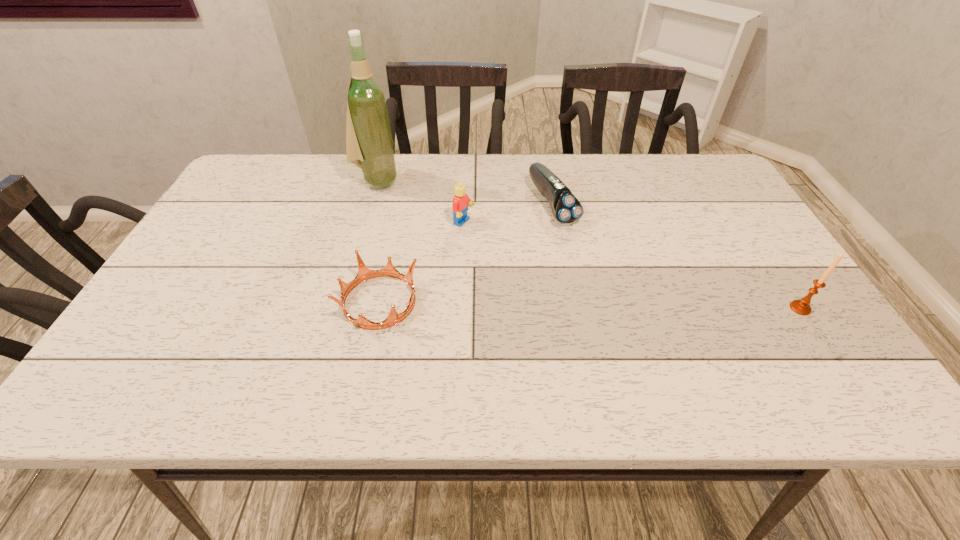
In order to click on crown in this screenshot , I will do `click(364, 273)`.

I want to click on the rightmost object, so click(x=801, y=307).

Locate an element on the screen. The width and height of the screenshot is (960, 540). the second tallest object is located at coordinates (801, 307).

Image resolution: width=960 pixels, height=540 pixels. I want to click on the third shortest object, so click(461, 201).

Identify the location of Lego. (461, 201).

You are a GUI agent. You are given a task and a screenshot of the screen. Output one action in this format:
    pyautogui.click(x=<x>, y=<y>)
    Task: Click on the tallest object
    
    Given the screenshot: What is the action you would take?
    pyautogui.click(x=369, y=145)

Where is `electric shaver`? Image resolution: width=960 pixels, height=540 pixels. electric shaver is located at coordinates (566, 208).

The width and height of the screenshot is (960, 540). Identify the location of blank space located 0.260m on the right of the crown. (534, 301).

The image size is (960, 540). Find the location of `free space located 0.400m on the back of the rightmost object`. free space located 0.400m on the back of the rightmost object is located at coordinates (727, 196).

At what (x,y) coordinates should I click in order to perform the action: click on vacant space located 0.180m on the face of the Lego. Please return your answer as a coordinate pair (x, y). This screenshot has width=960, height=540. Looking at the image, I should click on (532, 254).